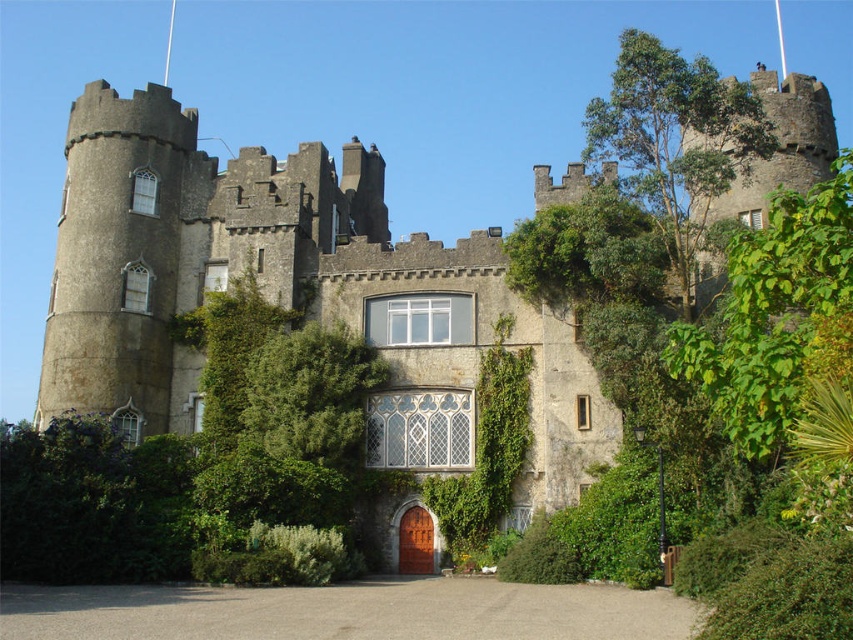
Is green leafy hedge at lower left behind mahogany wood door at center?

No, it is not.

Who is more forward, (122, 572) or (421, 513)?

Point (122, 572) is more forward.

Where is `green leafy hedge at lower left`? The width and height of the screenshot is (853, 640). green leafy hedge at lower left is located at coordinates (91, 504).

Describe the element at coordinates (344, 611) in the screenshot. I see `gray gravel driveway at lower center` at that location.

Is gray gravel driveway at lower center taller than green leafy hedge at lower left?

In fact, gray gravel driveway at lower center may be shorter than green leafy hedge at lower left.

Identify the location of gray gravel driveway at lower center. Image resolution: width=853 pixels, height=640 pixels. click(344, 611).

Image resolution: width=853 pixels, height=640 pixels. I want to click on gray gravel driveway at lower center, so click(x=344, y=611).

Can you confirm if gray stone castle at center is wider than green leafy hedge at lower left?

Yes.

Does gray stone castle at center have a smaller size compared to green leafy hedge at lower left?

No.

Does point (189, 428) come in front of point (113, 547)?

No, (189, 428) is behind (113, 547).

The image size is (853, 640). Find the location of `gray stone castle at center`. gray stone castle at center is located at coordinates (271, 276).